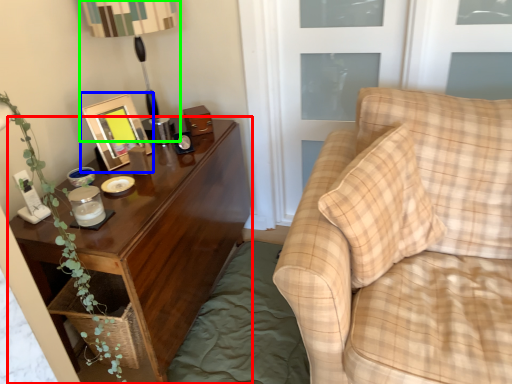
Question: Which object is positioned farthest from nightstand (highlighted by a red box)? Select from picture frame (highlighted by a blue box) and table lamp (highlighted by a green box).

Choices:
 (A) picture frame
 (B) table lamp

Answer: (B)